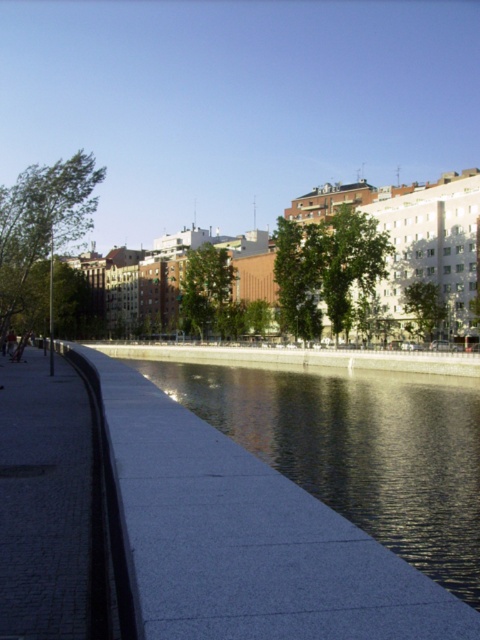
Describe the element at coordinates (249, 538) in the screenshot. I see `smooth concrete river at lower center` at that location.

Is point (424, 576) positioned after point (2, 381)?

No.

Describe the element at coordinates (249, 538) in the screenshot. The width and height of the screenshot is (480, 640). I see `smooth concrete river at lower center` at that location.

The image size is (480, 640). I want to click on smooth concrete river at lower center, so click(x=249, y=538).